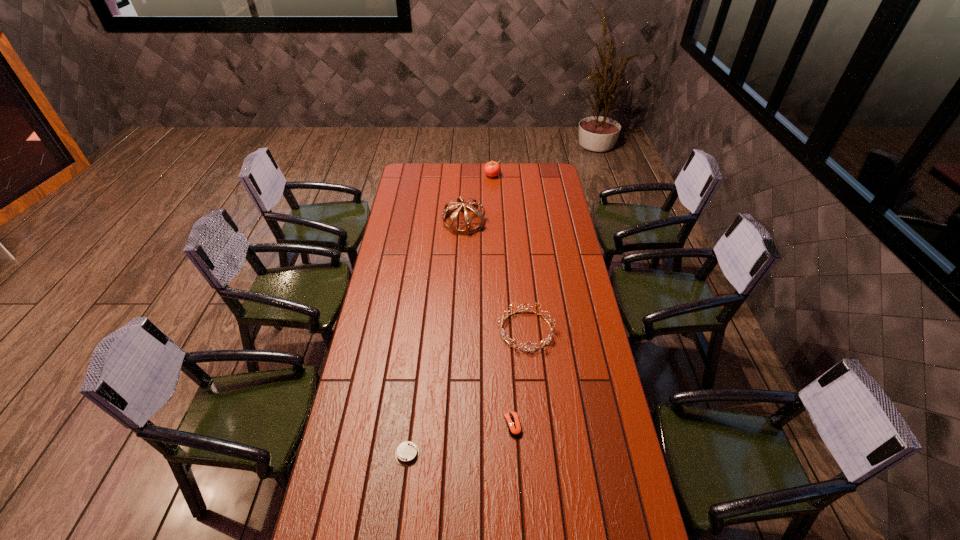
This screenshot has height=540, width=960. What are the coordinates of `the farther tiara` in the screenshot? It's located at (450, 227).

In order to click on the taller tiara in this screenshot , I will do `click(450, 227)`.

This screenshot has width=960, height=540. I want to click on the farthest object, so click(x=492, y=169).

What are the coordinates of `tomato` in the screenshot? It's located at (492, 169).

The width and height of the screenshot is (960, 540). I want to click on the third shortest object, so click(546, 341).

Image resolution: width=960 pixels, height=540 pixels. In order to click on the right tiara in this screenshot , I will do `click(546, 341)`.

You are a GUI agent. You are given a task and a screenshot of the screen. Output one action in this format:
    pyautogui.click(x=<x>, y=<y>)
    Task: Click on the fourth farthest object
    The image size is (960, 540).
    Given the screenshot: What is the action you would take?
    pyautogui.click(x=514, y=426)

Identify the location of computer mouse. The height and width of the screenshot is (540, 960). (514, 426).

Image resolution: width=960 pixels, height=540 pixels. In order to click on chocolate cake in this screenshot , I will do `click(407, 453)`.

Image resolution: width=960 pixels, height=540 pixels. I want to click on the nearest object, so click(407, 453).